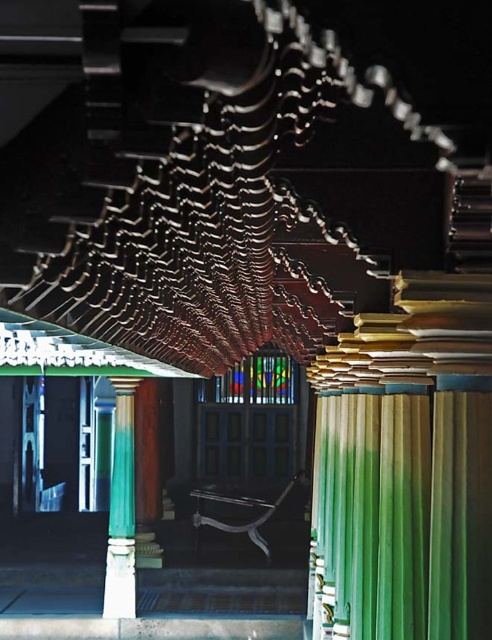
Question: Can you confirm if green fabric curtain at center is bigger than green polished column at center?

Choices:
 (A) no
 (B) yes

Answer: (A)

Question: Is green fabric curtain at center to the left of green polished column at center from the viewer's perspective?

Choices:
 (A) yes
 (B) no

Answer: (B)

Question: Which point appears farthest from the camera in this image?

Choices:
 (A) (421, 600)
 (B) (119, 401)

Answer: (B)

Question: Can you confirm if green fabric curtain at center is positioned to the left of green polished column at center?

Choices:
 (A) no
 (B) yes

Answer: (A)

Question: Among these objects, which one is farthest from the camera?

Choices:
 (A) green polished column at center
 (B) green fabric curtain at center

Answer: (A)

Question: Which of the following is the closest to the observer?

Choices:
 (A) (344, 480)
 (B) (118, 524)

Answer: (A)